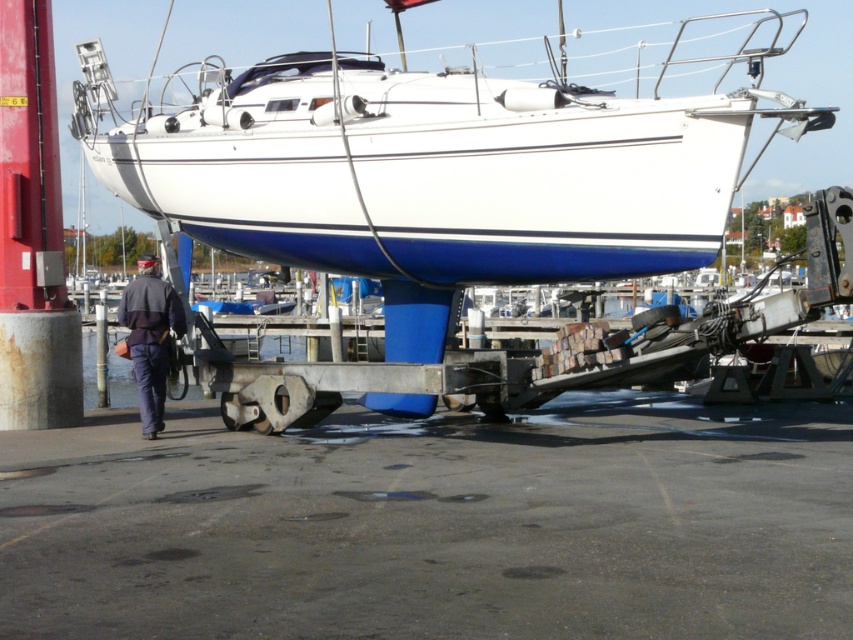
Question: Which point is closer to the camera?

Choices:
 (A) dark blue uniform at lower left
 (B) white glossy boat at center

Answer: (B)

Question: Can you confirm if white glossy boat at center is bigger than dark blue uniform at lower left?

Choices:
 (A) no
 (B) yes

Answer: (B)

Question: Observing the image, what is the correct spatial positioning of white glossy boat at center in reference to dark blue uniform at lower left?

Choices:
 (A) below
 (B) above

Answer: (B)

Question: Can you confirm if white glossy boat at center is positioned above dark blue uniform at lower left?

Choices:
 (A) no
 (B) yes

Answer: (B)

Question: Which of the following is the closest to the observer?

Choices:
 (A) (138, 298)
 (B) (251, 241)

Answer: (A)

Question: Which object is closer to the camera taking this photo?

Choices:
 (A) dark blue uniform at lower left
 (B) white glossy boat at center

Answer: (B)